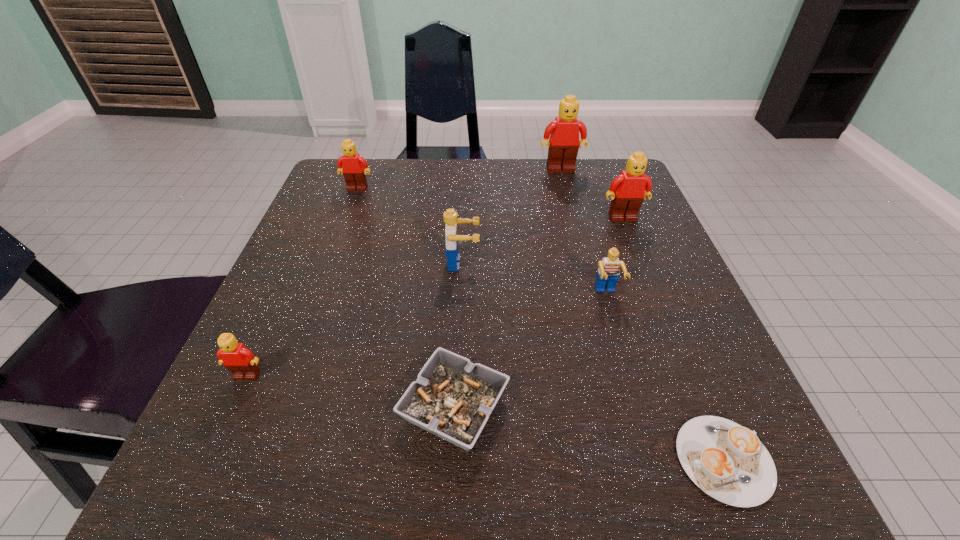
At what (x,y) coordinates should I click in order to perform the action: click on free point at the near edge. Please return your answer as a coordinate pair (x, y). Looking at the image, I should click on (436, 457).

The image size is (960, 540). I want to click on free space at the left edge of the desktop, so click(298, 292).

Find the location of `vacant position at the right edge of the desktop`. vacant position at the right edge of the desktop is located at coordinates (666, 316).

Image resolution: width=960 pixels, height=540 pixels. In the image, there is a desktop. Find the location of `vacant space at the near left corner`. vacant space at the near left corner is located at coordinates (307, 498).

Where is `vacant space at the far right corner of the desktop`? This screenshot has height=540, width=960. vacant space at the far right corner of the desktop is located at coordinates (590, 184).

This screenshot has height=540, width=960. I want to click on free space between the nearest brown Lego and the smaller blue Lego, so click(x=426, y=335).

Image resolution: width=960 pixels, height=540 pixels. In order to click on free spot between the fourth farthest Lego and the tallest object in this screenshot , I will do [512, 217].

This screenshot has width=960, height=540. In order to click on vacant point located between the third Lego from left to right and the third biggest brown Lego in this screenshot , I will do `click(410, 226)`.

The height and width of the screenshot is (540, 960). In order to click on empty location between the left blue Lego and the smaller blue Lego in this screenshot , I will do `click(535, 279)`.

Where is `free space between the third biggest brown Lego and the bigger blue Lego`? This screenshot has height=540, width=960. free space between the third biggest brown Lego and the bigger blue Lego is located at coordinates (410, 226).